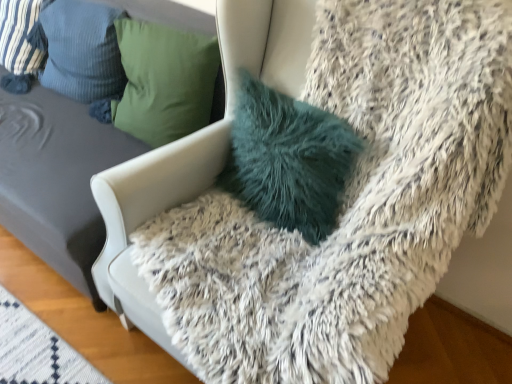
Question: Considering the positions of striped fabric pillow at upper left, which ranks as the first pillow in left-to-right order, and fuzzy white chair at upper right in the image, is striped fabric pillow at upper left, which ranks as the first pillow in left-to-right order, bigger or smaller than fuzzy white chair at upper right?

Choices:
 (A) big
 (B) small

Answer: (B)

Question: From the image's perspective, relative to fuzzy white chair at upper right, is striped fabric pillow at upper left, which ranks as the first pillow in left-to-right order, above or below?

Choices:
 (A) above
 (B) below

Answer: (A)

Question: Estimate the real-world distances between objects in this image. Which object is farther from the striped fabric pillow at upper left, which ranks as the first pillow in left-to-right order?

Choices:
 (A) striped fabric pillow at upper left, arranged as the second pillow when viewed from the left
 (B) fuzzy white chair at upper right
 (C) teal fuzzy pillow at center, the 3th pillow viewed from the left

Answer: (C)

Question: Which is farther from the teal fuzzy pillow at center, which ranks as the 1th pillow in right-to-left order?

Choices:
 (A) fuzzy white chair at upper right
 (B) striped fabric pillow at upper left, which ranks as the first pillow in left-to-right order
 (C) striped fabric pillow at upper left, arranged as the second pillow when viewed from the left

Answer: (B)